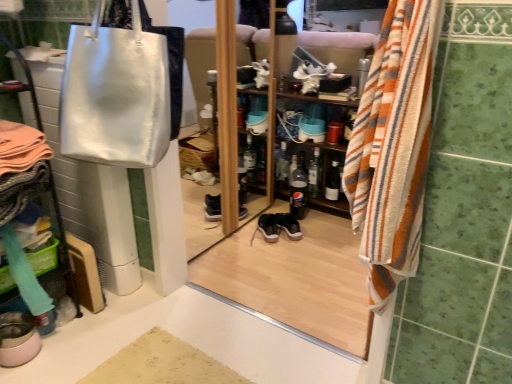
This screenshot has height=384, width=512. Find the location of `vacant area located to the right-hand side of metallic silver bowl at lower left, positioned as the second footwear in right-to-left order`. vacant area located to the right-hand side of metallic silver bowl at lower left, positioned as the second footwear in right-to-left order is located at coordinates (67, 350).